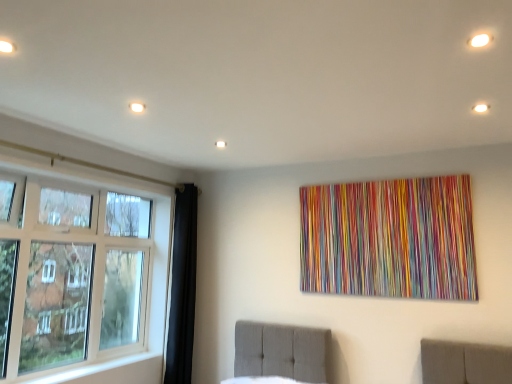
What do you see at coordinates (88, 279) in the screenshot? I see `white glass window at left` at bounding box center [88, 279].

The image size is (512, 384). I want to click on white glossy light at upper right, which is the second light from left to right, so click(480, 108).

At what (x,y) coordinates should I click in order to perform the action: click on window below the white glossy light at upper right, marked as the 1th light in a right-to-left arrangement (from the image's perspective). Please return your answer as a coordinate pair (x, y). Looking at the image, I should click on (88, 279).

Does point (93, 318) come in front of point (478, 104)?

No, it is not.

How many degrees apart are the facing directions of white glass window at left and white glossy light at upper right, marked as the 1th light in a right-to-left arrangement?

They differ by 180 degrees in their facing directions.

Is white glass window at left at the left side of white glossy light at upper right, which is the second light from left to right?

Yes, white glass window at left is to the left of white glossy light at upper right, which is the second light from left to right.

Measure the distance from white glossy light at upper right, which is the second light from left to right, to white glass window at left.

They are 2.76 meters apart.

Locate an element on the screen. Image resolution: width=512 pixels, height=384 pixels. window below the white glossy light at upper right, marked as the 1th light in a right-to-left arrangement (from the image's perspective) is located at coordinates (88, 279).

Does white glossy light at upper right, marked as the 1th light in a right-to-left arrangement, come behind white glass window at left?

No, white glossy light at upper right, marked as the 1th light in a right-to-left arrangement, is closer to the camera.

Considering the relative sizes of white glass window at left and white matte light fixture at upper left, the second light in the right-to-left sequence, in the image provided, is white glass window at left bigger than white matte light fixture at upper left, the second light in the right-to-left sequence,?

Correct, white glass window at left is larger in size than white matte light fixture at upper left, the second light in the right-to-left sequence.

In the scene shown: Which is correct: white glass window at left is inside white matte light fixture at upper left, the second light in the right-to-left sequence, or outside of it?

white glass window at left lies outside white matte light fixture at upper left, the second light in the right-to-left sequence.

Is white glass window at left next to white matte light fixture at upper left, the second light in the right-to-left sequence, and touching it?

No, white glass window at left is not in contact with white matte light fixture at upper left, the second light in the right-to-left sequence.

Considering the positions of point (142, 106) and point (124, 239), is point (142, 106) closer or farther from the camera than point (124, 239)?

Point (142, 106) appears to be closer to the viewer than point (124, 239).

Which of these two, white matte light fixture at upper left, the second light in the right-to-left sequence, or white glass window at left, is wider?

white glass window at left is wider.

Can you confirm if white matte light fixture at upper left, the second light in the right-to-left sequence, is smaller than white glass window at left?

Correct, white matte light fixture at upper left, the second light in the right-to-left sequence, occupies less space than white glass window at left.

Where is `light that appears above the white glossy light at upper right, which is the second light from left to right (from the image's perspective)`? light that appears above the white glossy light at upper right, which is the second light from left to right (from the image's perspective) is located at coordinates (137, 107).

Who is shorter, white matte light fixture at upper left, the second light in the right-to-left sequence, or white glossy light at upper right, marked as the 1th light in a right-to-left arrangement?

white matte light fixture at upper left, the second light in the right-to-left sequence, is shorter.

Based on the photo, which is behind, white matte light fixture at upper left, the second light in the right-to-left sequence, or white glossy light at upper right, which is the second light from left to right?

white matte light fixture at upper left, the second light in the right-to-left sequence, is behind.

From the image's perspective, would you say white matte light fixture at upper left, the second light in the right-to-left sequence, is positioned over white glossy light at upper right, which is the second light from left to right?

Correct, white matte light fixture at upper left, the second light in the right-to-left sequence, appears higher than white glossy light at upper right, which is the second light from left to right, in the image.

Is white glossy light at upper right, marked as the 1th light in a right-to-left arrangement, next to white matte light fixture at upper left, the second light in the right-to-left sequence?

There is a gap between white glossy light at upper right, marked as the 1th light in a right-to-left arrangement, and white matte light fixture at upper left, the second light in the right-to-left sequence.

From the image's perspective, is white glossy light at upper right, marked as the 1th light in a right-to-left arrangement, over white matte light fixture at upper left, the 1th light positioned from the left?

No, from the image's perspective, white glossy light at upper right, marked as the 1th light in a right-to-left arrangement, is not over white matte light fixture at upper left, the 1th light positioned from the left.

How many degrees apart are the facing directions of white glossy light at upper right, which is the second light from left to right, and white matte light fixture at upper left, the second light in the right-to-left sequence?

179 degrees.

Is white glossy light at upper right, marked as the 1th light in a right-to-left arrangement, at the left side of white matte light fixture at upper left, the second light in the right-to-left sequence?

Incorrect, white glossy light at upper right, marked as the 1th light in a right-to-left arrangement, is not on the left side of white matte light fixture at upper left, the second light in the right-to-left sequence.

The height and width of the screenshot is (384, 512). What are the coordinates of `window that is under the white glossy light at upper right, which is the second light from left to right (from a real-world perspective)` in the screenshot? It's located at (88, 279).

Where is `light in front of the white glass window at left`? The height and width of the screenshot is (384, 512). light in front of the white glass window at left is located at coordinates (480, 108).

From the image, which object appears to be nearer to white glossy light at upper right, marked as the 1th light in a right-to-left arrangement, white glass window at left or white matte light fixture at upper left, the second light in the right-to-left sequence?

white matte light fixture at upper left, the second light in the right-to-left sequence, is closer to white glossy light at upper right, marked as the 1th light in a right-to-left arrangement.

Looking at the image, which one is located closer to white glass window at left, white matte light fixture at upper left, the second light in the right-to-left sequence, or white glossy light at upper right, marked as the 1th light in a right-to-left arrangement?

white matte light fixture at upper left, the second light in the right-to-left sequence.

Based on their spatial positions, is white glossy light at upper right, marked as the 1th light in a right-to-left arrangement, or white glass window at left closer to white matte light fixture at upper left, the 1th light positioned from the left?

Among the two, white glass window at left is located nearer to white matte light fixture at upper left, the 1th light positioned from the left.

Which object lies nearer to the anchor point white glass window at left, white glossy light at upper right, marked as the 1th light in a right-to-left arrangement, or white matte light fixture at upper left, the 1th light positioned from the left?

white matte light fixture at upper left, the 1th light positioned from the left, is positioned closer to the anchor white glass window at left.

From the image, which object appears to be nearer to white matte light fixture at upper left, the 1th light positioned from the left, white glass window at left or white glossy light at upper right, which is the second light from left to right?

The object closer to white matte light fixture at upper left, the 1th light positioned from the left, is white glass window at left.

Which object lies further to the anchor point white glossy light at upper right, which is the second light from left to right, white matte light fixture at upper left, the second light in the right-to-left sequence, or white glass window at left?

white glass window at left is positioned further to the anchor white glossy light at upper right, which is the second light from left to right.

This screenshot has width=512, height=384. I want to click on light situated between white glass window at left and white glossy light at upper right, marked as the 1th light in a right-to-left arrangement, from left to right, so click(x=137, y=107).